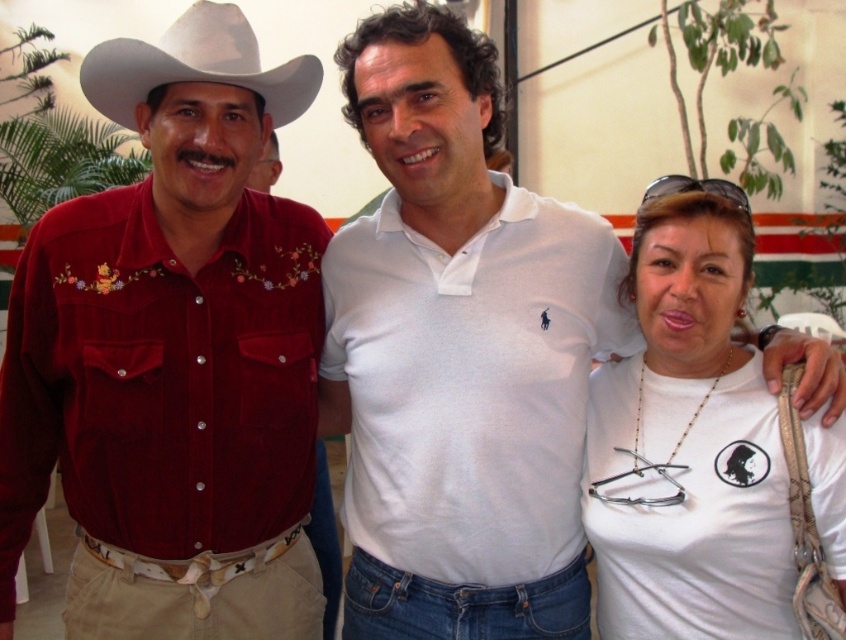
Which red shirt is positioned to the left when looking at the velvet red shirt at center and the matte red shirt at left?

The velvet red shirt at center is positioned to the left of the matte red shirt at left.

Based on the scene description, which individual is wearing a taller shirt between the velvet red shirt at center and the matte red shirt at left?

The velvet red shirt at center is much taller than the matte red shirt at left.